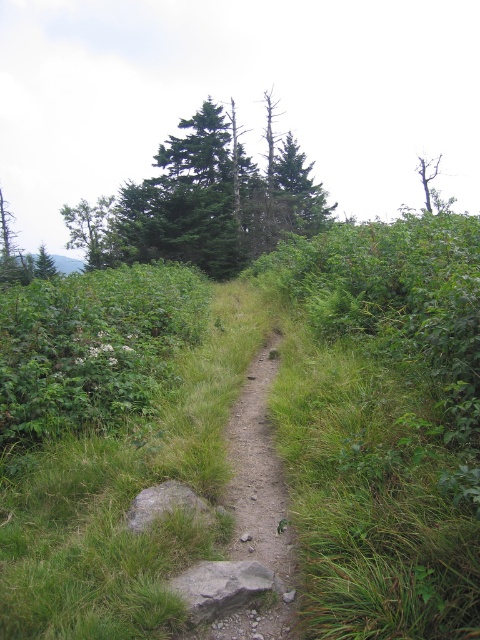
Question: Among these objects, which one is farthest from the camera?

Choices:
 (A) green leafy tree at upper right
 (B) dirt path at center
 (C) green matte tree at upper left
 (D) green matte tree at upper center

Answer: (A)

Question: Does green matte tree at upper center appear on the left side of green leafy tree at upper right?

Choices:
 (A) no
 (B) yes

Answer: (B)

Question: Which object appears closest to the camera in this image?

Choices:
 (A) green matte tree at upper center
 (B) green matte tree at upper left

Answer: (A)

Question: Is green matte tree at upper left wider than green leafy tree at upper right?

Choices:
 (A) no
 (B) yes

Answer: (A)

Question: Which point is farther from the camera taking this photo?

Choices:
 (A) (437, 156)
 (B) (220, 232)
 (C) (84, 216)
 (D) (259, 536)

Answer: (A)

Question: Is green matte tree at upper left to the right of green leafy tree at upper right from the viewer's perspective?

Choices:
 (A) yes
 (B) no

Answer: (B)